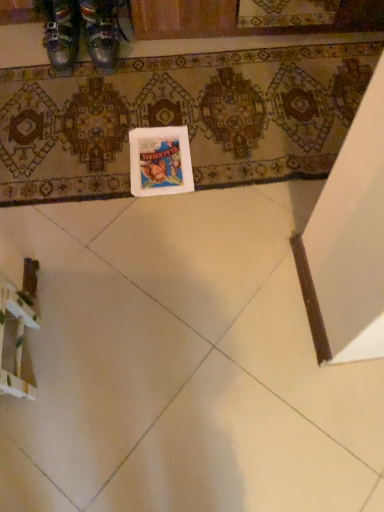
This screenshot has height=512, width=384. Find the location of `vacant location behind white matte postcard at center`. vacant location behind white matte postcard at center is located at coordinates (161, 108).